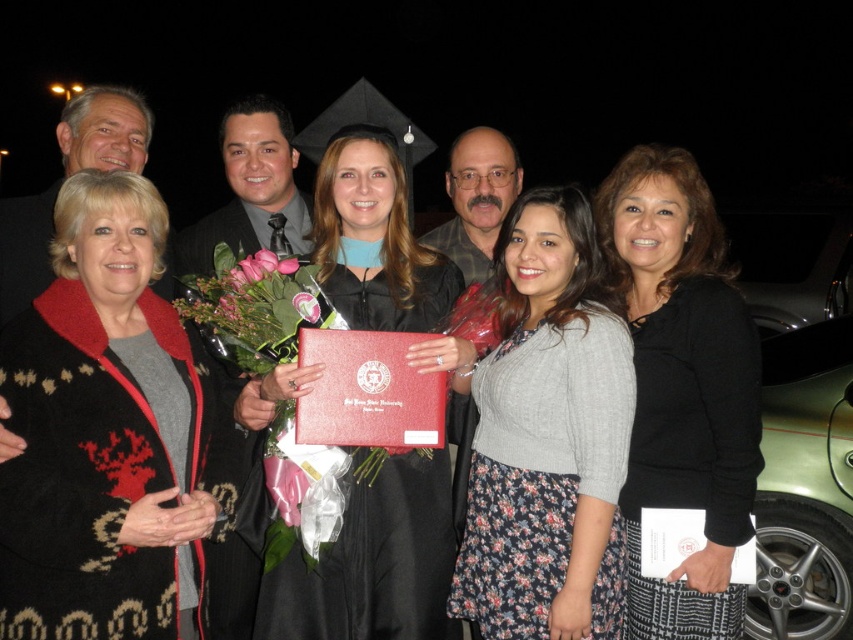
Question: Which object is closer to the camera taking this photo?

Choices:
 (A) floral print dress at center
 (B) pink silk bouquet at center

Answer: (A)

Question: Is knitted wool sweater at left closer to camera compared to pink silk bouquet at center?

Choices:
 (A) no
 (B) yes

Answer: (B)

Question: Which of the following is the farthest from the observer?

Choices:
 (A) (312, 300)
 (B) (148, 420)

Answer: (A)

Question: Can you confirm if floral print dress at center is positioned to the left of green metallic car at lower right?

Choices:
 (A) no
 (B) yes

Answer: (B)

Question: Is floral print dress at center bigger than green metallic car at lower right?

Choices:
 (A) yes
 (B) no

Answer: (B)

Question: Considering the real-world distances, which object is farthest from the pink silk bouquet at center?

Choices:
 (A) black sweater at center
 (B) knitted wool sweater at left

Answer: (A)